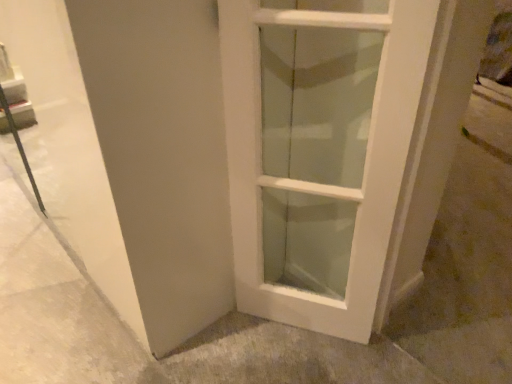
In order to face white matte door at center, should I rotate leftwards or rightwards?

To face it directly, rotate right by 7.267 degrees.

Identify the location of white matte door at center. The width and height of the screenshot is (512, 384). (322, 152).

Describe the element at coordinates (322, 152) in the screenshot. I see `white matte door at center` at that location.

Measure the distance between point (383,107) and camera.

37.99 inches.

Identify the location of white matte door at center. tap(322, 152).